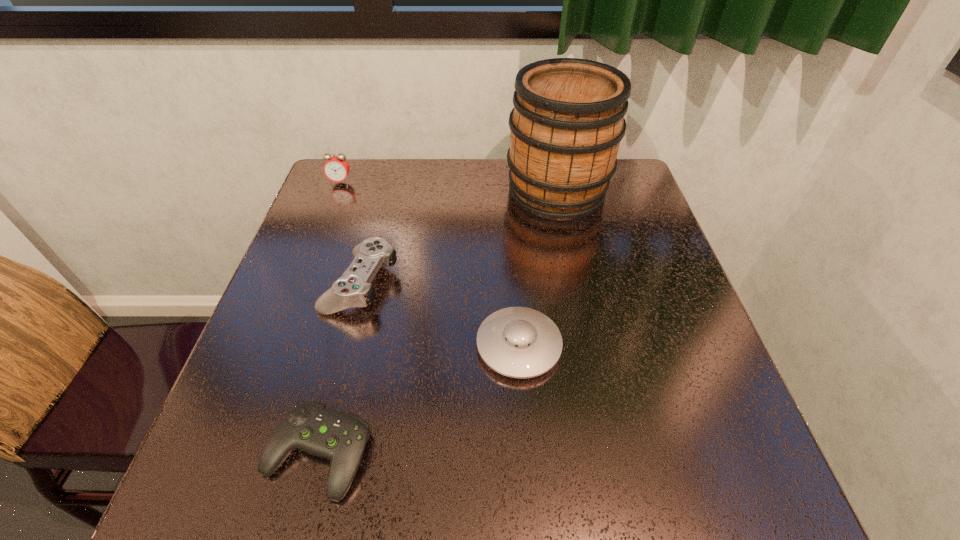
Locate an element on the screen. This screenshot has width=960, height=540. cider is located at coordinates (568, 120).

Where is `alarm clock`? The height and width of the screenshot is (540, 960). alarm clock is located at coordinates (336, 168).

At what (x,y) coordinates should I click in order to perform the action: click on the fourth shortest object. Please return your answer as a coordinate pair (x, y). This screenshot has width=960, height=540. Looking at the image, I should click on (336, 168).

The image size is (960, 540). I want to click on the taller control, so click(353, 289).

This screenshot has width=960, height=540. Identify the location of the third tallest object. (353, 289).

This screenshot has height=540, width=960. Find the location of `the second shortest object`. the second shortest object is located at coordinates (518, 342).

Locate an element on the screen. The image size is (960, 540). the nearer control is located at coordinates (311, 427).

At what (x,y) coordinates should I click in order to perform the action: click on the nearest object. Please return your answer as a coordinate pair (x, y). Image resolution: width=960 pixels, height=540 pixels. Looking at the image, I should click on (311, 427).

Where is `free space located on the left of the tallest object`? The width and height of the screenshot is (960, 540). free space located on the left of the tallest object is located at coordinates (484, 192).

I want to click on vacant space located 0.390m on the front-facing side of the leftmost object, so click(x=300, y=287).